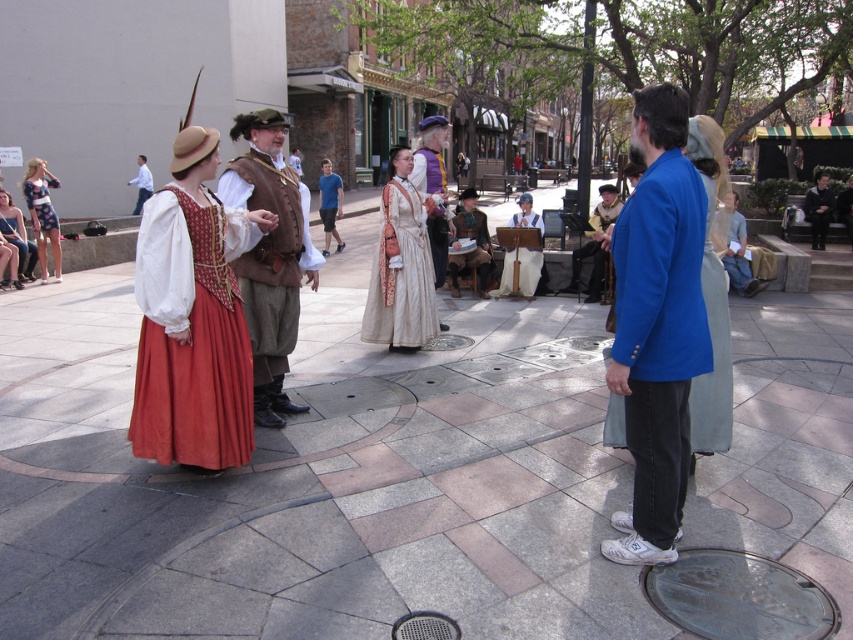
Who is lower down, white satin dress at center or blue fabric coat at center?

Positioned lower is white satin dress at center.

Locate an element on the screen. The width and height of the screenshot is (853, 640). white satin dress at center is located at coordinates (428, 173).

You are a GUI agent. You are given a task and a screenshot of the screen. Output one action in this format:
    pyautogui.click(x=<x>, y=<y>)
    Task: Click on the white satin dress at center
    Image resolution: width=853 pixels, height=640 pixels.
    Given the screenshot: What is the action you would take?
    pyautogui.click(x=428, y=173)

Can you confirm if bronze textured manhole cover at center is shorter than printed cotton dress at left?

Indeed, bronze textured manhole cover at center has a lesser height compared to printed cotton dress at left.

Does bronze textured manhole cover at center appear over printed cotton dress at left?

No, bronze textured manhole cover at center is not above printed cotton dress at left.

Does point (650, 570) come in front of point (42, 193)?

That is True.

At what (x,y) coordinates should I click in order to perform the action: click on bronze textured manhole cover at center. Please return your answer as a coordinate pair (x, y). The width and height of the screenshot is (853, 640). Looking at the image, I should click on [x=740, y=596].

Is blue cotton jacket at center wider than white cotton dress at center?

Indeed, blue cotton jacket at center has a greater width compared to white cotton dress at center.

Who is more forward, (693, 332) or (320, 195)?

Point (693, 332) is more forward.

The width and height of the screenshot is (853, 640). I want to click on blue cotton jacket at center, so click(x=657, y=323).